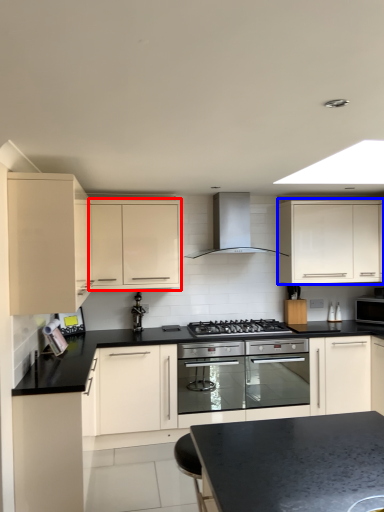
Question: Which object is further to the camera taking this photo, cabinetry (highlighted by a red box) or cabinetry (highlighted by a blue box)?

Choices:
 (A) cabinetry
 (B) cabinetry

Answer: (B)